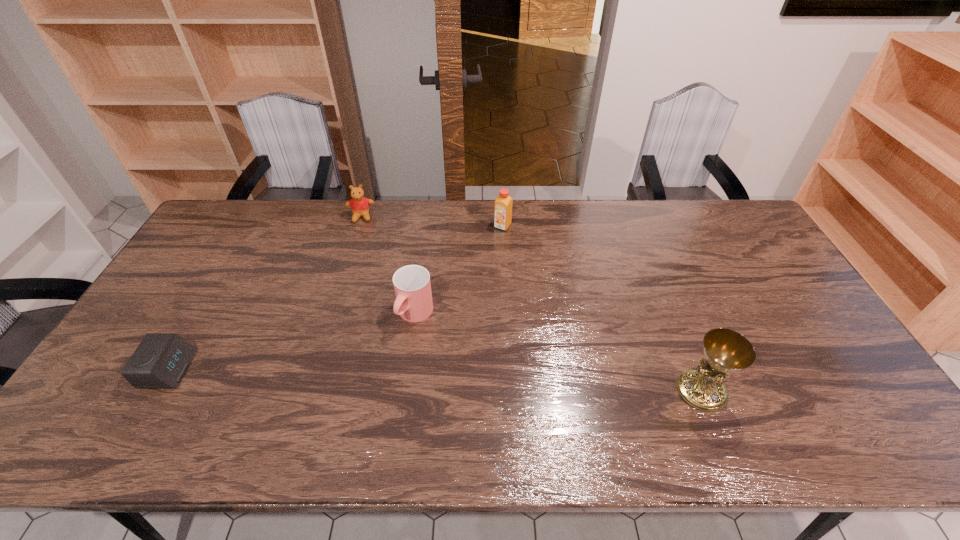
This screenshot has height=540, width=960. Find the location of `free space that satisfies the following two spatial constraints: 1. on the front side of the tallest object; 2. on the right side of the second object from left to right`. free space that satisfies the following two spatial constraints: 1. on the front side of the tallest object; 2. on the right side of the second object from left to right is located at coordinates coord(307,390).

The width and height of the screenshot is (960, 540). Identify the location of free location that satisfies the following two spatial constraints: 1. on the front side of the fourth object from right to left; 2. on the right side of the tallest object. (307, 390).

You are a GUI agent. You are given a task and a screenshot of the screen. Output one action in this format:
    pyautogui.click(x=<x>, y=<y>)
    Task: Click on the vacant space that satisfies the following two spatial constraints: 1. on the front side of the third object from right to left; 2. on the left side of the second object from left to right
    
    Given the screenshot: What is the action you would take?
    pyautogui.click(x=330, y=314)